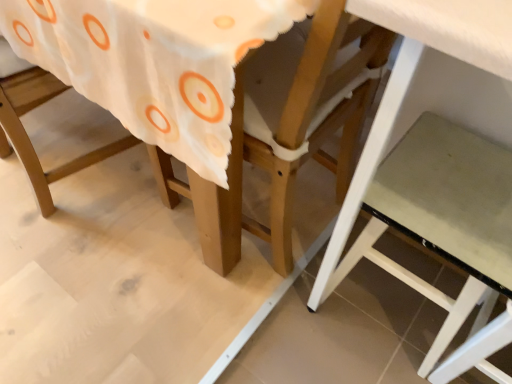
Question: Is white matte step stool at lower right at the left side of wooden chair at center?

Choices:
 (A) no
 (B) yes

Answer: (A)

Question: Is the position of white matte step stool at lower right more distant than that of wooden chair at center?

Choices:
 (A) no
 (B) yes

Answer: (B)

Question: From a real-world perspective, does white matte step stool at lower right stand above wooden chair at center?

Choices:
 (A) yes
 (B) no

Answer: (B)

Question: Does white matte step stool at lower right have a lesser height compared to wooden chair at center?

Choices:
 (A) yes
 (B) no

Answer: (A)

Question: From a real-world perspective, is white matte step stool at lower right positioned under wooden chair at center based on gravity?

Choices:
 (A) no
 (B) yes

Answer: (B)

Question: Considering the relative sizes of white matte step stool at lower right and wooden chair at center in the image provided, is white matte step stool at lower right bigger than wooden chair at center?

Choices:
 (A) no
 (B) yes

Answer: (A)

Question: From the image's perspective, is wooden chair at center under white matte step stool at lower right?

Choices:
 (A) no
 (B) yes

Answer: (A)

Question: Is wooden chair at center smaller than white matte step stool at lower right?

Choices:
 (A) yes
 (B) no

Answer: (B)

Question: Are wooden chair at center and white matte step stool at lower right far apart?

Choices:
 (A) yes
 (B) no

Answer: (B)

Question: From a real-world perspective, is wooden chair at center located beneath white matte step stool at lower right?

Choices:
 (A) no
 (B) yes

Answer: (A)

Question: From the image's perspective, is wooden chair at center on white matte step stool at lower right?

Choices:
 (A) yes
 (B) no

Answer: (A)

Question: Is the position of wooden chair at center more distant than that of white matte step stool at lower right?

Choices:
 (A) yes
 (B) no

Answer: (B)

Question: In terms of size, does white matte step stool at lower right appear bigger or smaller than wooden chair at center?

Choices:
 (A) small
 (B) big

Answer: (A)